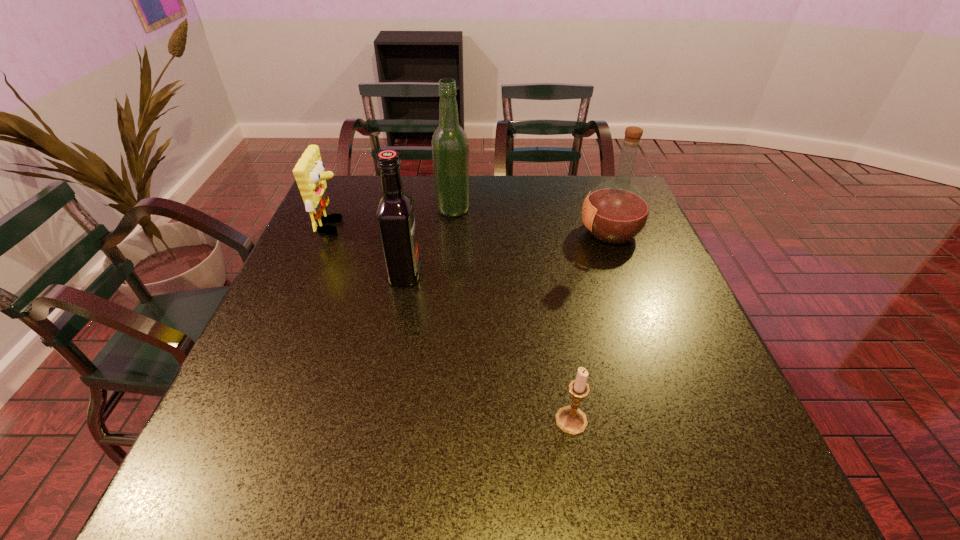
You are a GUI agent. You are given a task and a screenshot of the screen. Output one action in this format:
    pyautogui.click(x=<x>, y=<y>)
    Task: Click on the vacant space at the far edge
    
    Given the screenshot: What is the action you would take?
    pyautogui.click(x=491, y=183)

The image size is (960, 540). In the image, there is a desktop. In order to click on vacant space at the near edge in this screenshot , I will do `click(406, 502)`.

I want to click on blank area at the left edge, so click(263, 414).

You are a GUI agent. You are given a task and a screenshot of the screen. Output one action in this format:
    pyautogui.click(x=<x>, y=<y>)
    Task: Click on the vacant space at the right edge
    This screenshot has height=540, width=960.
    Given the screenshot: What is the action you would take?
    pyautogui.click(x=691, y=440)

Locate an element on the screen. This screenshot has width=960, height=540. vacant area at the far left corner is located at coordinates (356, 181).

You are a GUI agent. You are given a task and a screenshot of the screen. Output one action in this format:
    pyautogui.click(x=<x>, y=<y>)
    Task: Click on the free location at the near left corner of the desktop
    
    Given the screenshot: What is the action you would take?
    (211, 495)

The image size is (960, 540). Identify the location of vacant space at the far right corner of the desktop. (593, 186).

I want to click on unoccupied area between the candle holder and the fourth object from right to left, so click(488, 347).

Image resolution: width=960 pixels, height=540 pixels. Find the location of `vacant space that's between the nearest liquor and the nearest object`. vacant space that's between the nearest liquor and the nearest object is located at coordinates (488, 347).

The width and height of the screenshot is (960, 540). I want to click on vacant area between the rightmost liquor and the third object from right to left, so click(532, 221).